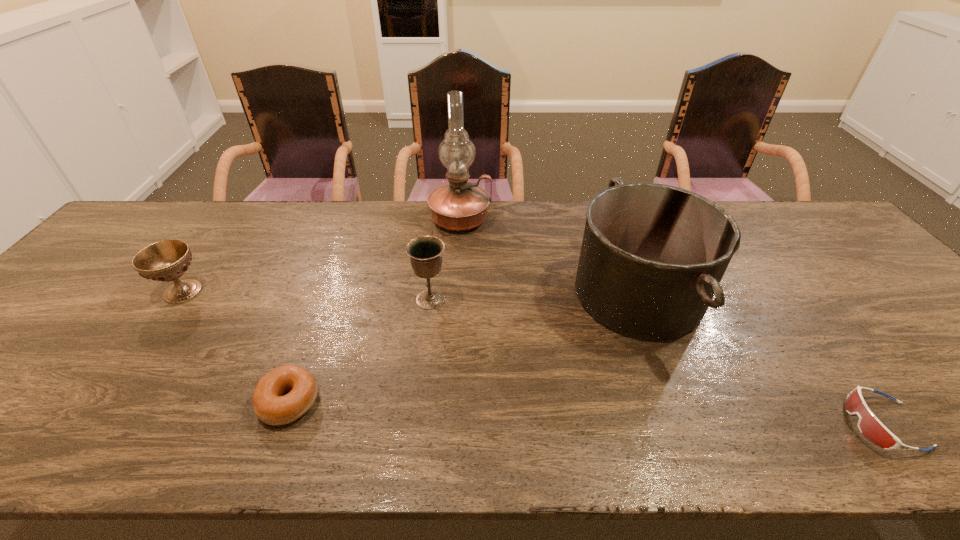
This screenshot has width=960, height=540. I want to click on oil lamp, so click(460, 206).

Locate an element on the screen. The height and width of the screenshot is (540, 960). the farthest object is located at coordinates (460, 206).

The width and height of the screenshot is (960, 540). Find the location of `the second tallest object`. the second tallest object is located at coordinates (653, 255).

Find the location of a particular element. pan is located at coordinates (653, 255).

In order to click on the taller chalice in this screenshot , I will do `click(425, 252)`.

The height and width of the screenshot is (540, 960). Identify the location of the third tallest object. (425, 252).

Image resolution: width=960 pixels, height=540 pixels. Find the location of `the left chalice`. the left chalice is located at coordinates (167, 260).

The image size is (960, 540). In order to click on the third shortest object in this screenshot , I will do `click(167, 260)`.

The height and width of the screenshot is (540, 960). In order to click on the fifth object from right to left in this screenshot , I will do `click(270, 406)`.

Locate an element on the screen. goggles is located at coordinates (869, 425).